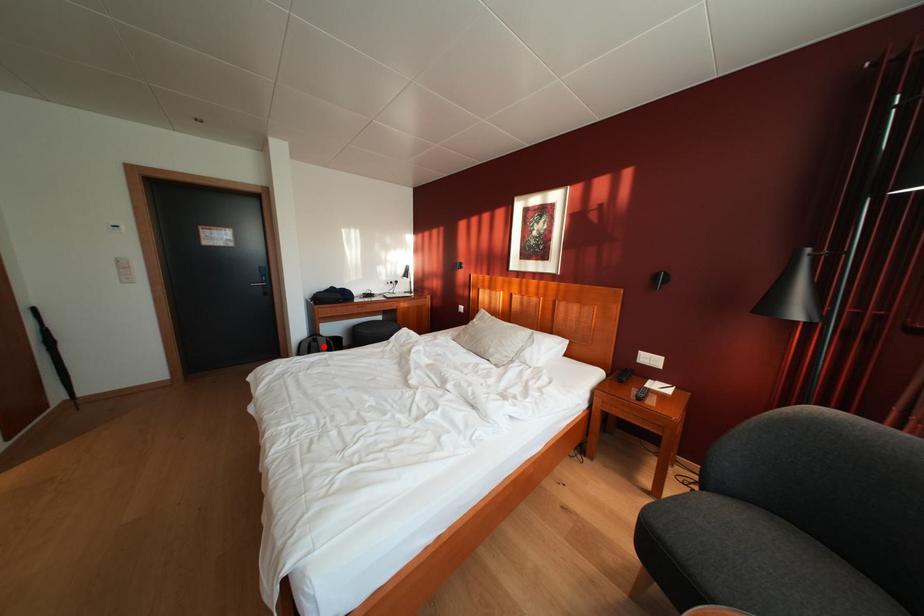
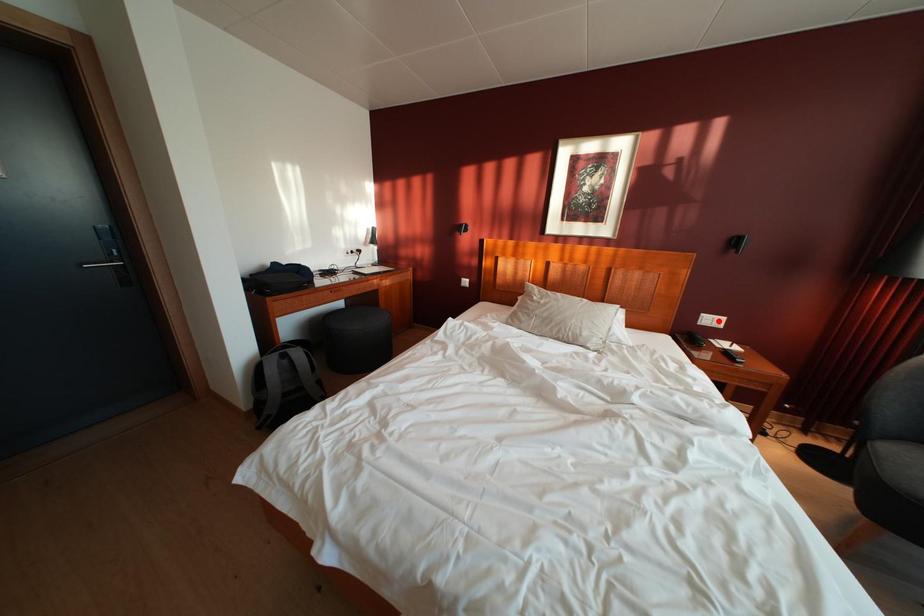
I am providing you with two images of the same scene from different viewpoints. A red point is marked on the first image and another point is marked on the second image. Is the marked point in image1 the same physical position as the marked point in image2?

No